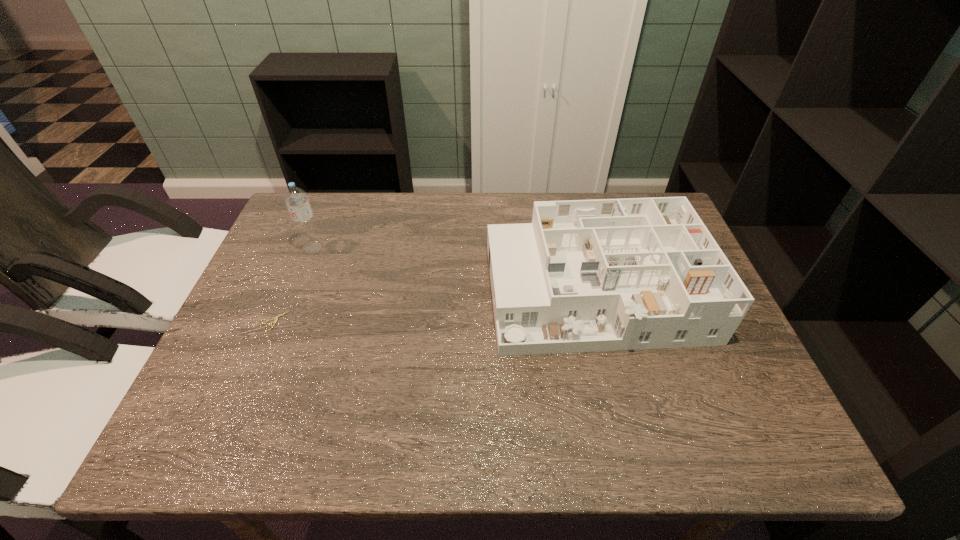
The height and width of the screenshot is (540, 960). I want to click on vacant area at the far edge of the desktop, so click(x=579, y=197).

The image size is (960, 540). In the image, there is a desktop. What are the coordinates of `vacant space at the near edge` in the screenshot? It's located at (584, 421).

What are the coordinates of `vacant area at the left edge` in the screenshot? It's located at (259, 393).

Image resolution: width=960 pixels, height=540 pixels. I want to click on free space at the right edge of the desktop, so click(x=671, y=357).

In the image, there is a desktop. Identify the location of vacant space at the near left corner. The height and width of the screenshot is (540, 960). (181, 427).

Find the location of a particular element. The image size is (960, 540). vacant space in between the shears and the water bottle is located at coordinates (294, 284).

Locate an element on the screen. vacant area between the tallest object and the second shortest object is located at coordinates (453, 269).

At what (x,y) coordinates should I click in order to perform the action: click on vacant area that lies between the tallest object and the shortest object. Please return your answer as a coordinate pair (x, y). The width and height of the screenshot is (960, 540). Looking at the image, I should click on (294, 284).

Find the location of `free spot between the rightmost object and the shears`. free spot between the rightmost object and the shears is located at coordinates [x=435, y=306].

Identify the location of vacant region between the shortest object and the rightmost object. (435, 306).